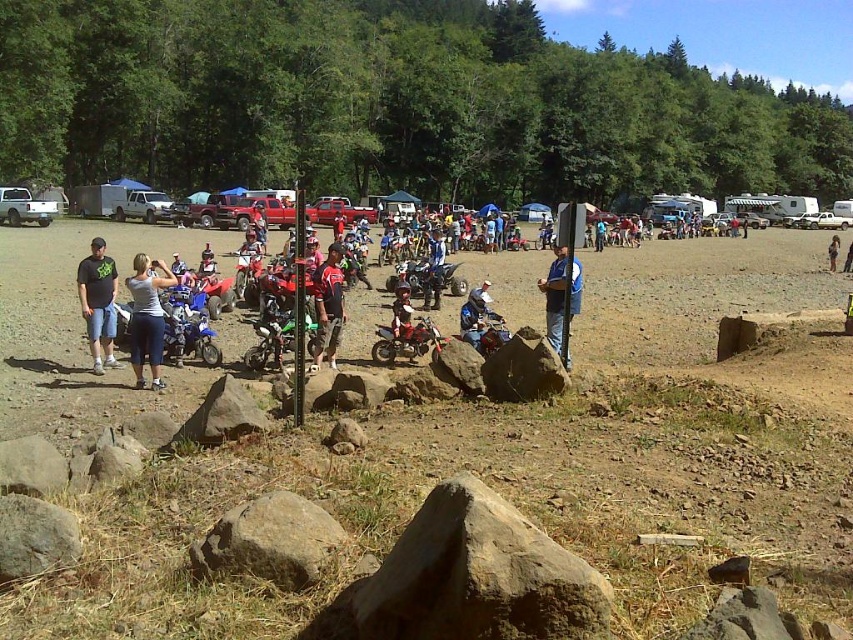
You are a photographer at the event and want to capture a photo of the dark gray t shirt at left. You are standing at the point with coordinates (97,301). Is the dark gray t shirt at left visible from your current position?

The dark gray t shirt at left is located exactly at the point where you are standing, so it would be visible from your current position.

You are a photographer at the event and want to capture both the blue metallic motorcycle at center and the matte black motorcycle at center in a single shot. Based on their positions, which motorcycle should you focus on first to ensure both are in frame?

The blue metallic motorcycle at center is located below the matte black motorcycle at center, so you should focus on the matte black motorcycle at center first to ensure both are in frame.

You are a photographer setting up a tripod to capture the blue metallic motorcycle at center and the matte black motorcycle at center. Since you want to ensure both motorcycles are in focus, you need to know which one is shorter. Which motorcycle is shorter?

The blue metallic motorcycle at center has a lesser height compared to the matte black motorcycle at center, so the blue metallic motorcycle at center is shorter.